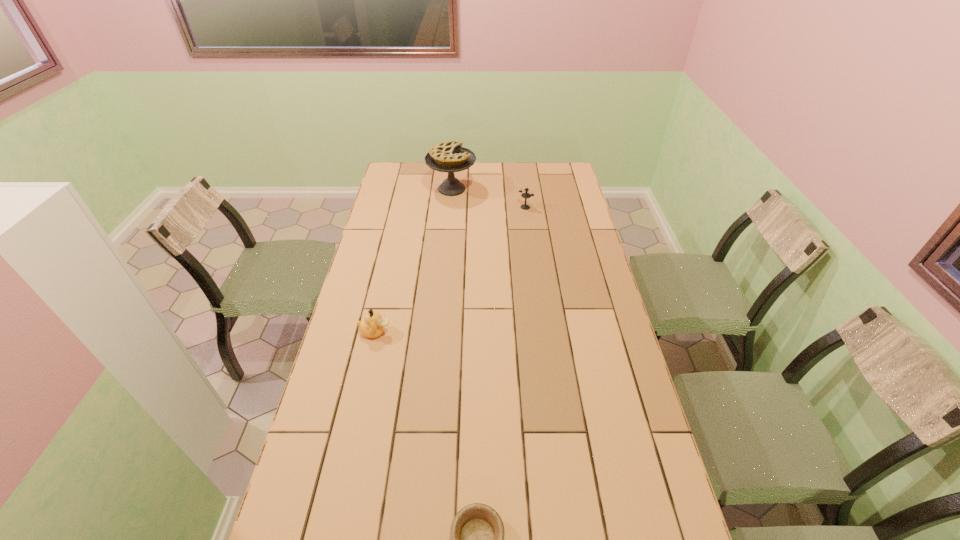
At what (x,y) coordinates should I click in order to perform the action: click on blank area in the image that satisfies the following two spatial constraints: 1. on the front side of the third nearest object; 2. on the face of the duckling. Please return your answer as a coordinate pair (x, y). Looking at the image, I should click on (541, 332).

At what (x,y) coordinates should I click in order to perform the action: click on free space in the image that satisfies the following two spatial constraints: 1. on the back side of the third nearest object; 2. on the cut side of the pie. Please return your answer as a coordinate pair (x, y). The height and width of the screenshot is (540, 960). Looking at the image, I should click on (523, 189).